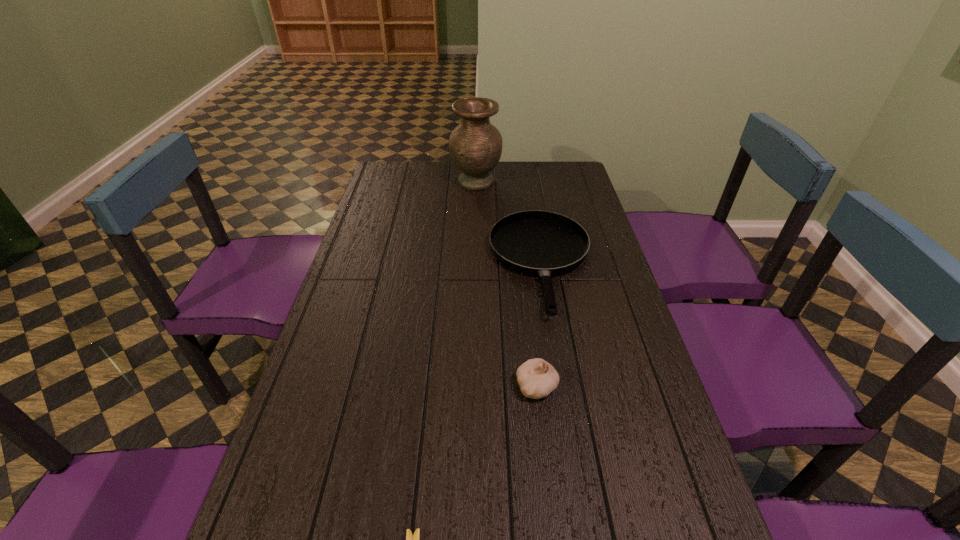
Locate an element on the screen. object situated at the right edge is located at coordinates (540, 243).

At what (x,y) coordinates should I click in order to perform the action: click on free space at the far edge of the desktop. Please return your answer as a coordinate pair (x, y). This screenshot has width=960, height=540. Looking at the image, I should click on point(431,178).

In order to click on free space at the left edge of the desktop in this screenshot , I will do `click(311, 392)`.

What are the coordinates of `free space at the right edge of the desktop` in the screenshot? It's located at (649, 381).

Locate an element on the screen. vacant region at the far right corner of the desktop is located at coordinates (543, 171).

Where is `free space between the vase and the garlic`? The height and width of the screenshot is (540, 960). free space between the vase and the garlic is located at coordinates (506, 284).

Where is `vacant space that's between the second nearest object and the third nearest object`? The height and width of the screenshot is (540, 960). vacant space that's between the second nearest object and the third nearest object is located at coordinates (539, 326).

The width and height of the screenshot is (960, 540). In order to click on vacant space that is in between the second shortest object and the second tallest object in this screenshot , I will do [x=539, y=326].

Find the location of `vacant space in between the garlic and the third tallest object`. vacant space in between the garlic and the third tallest object is located at coordinates (539, 326).

Identify the location of object that stands as the third closest to the shortest object. (475, 145).